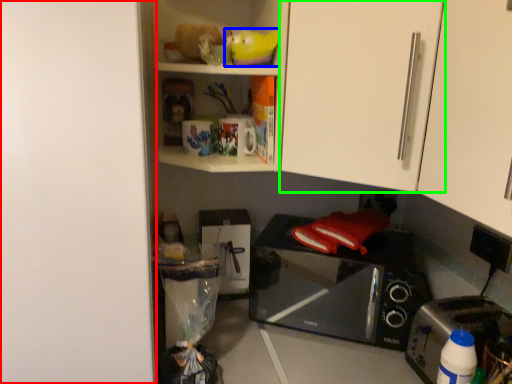
Question: Which object is positioned closest to door (highlighted by a red box)? Select from toy (highlighted by a blue box) and cabinetry (highlighted by a green box).

Choices:
 (A) toy
 (B) cabinetry

Answer: (B)